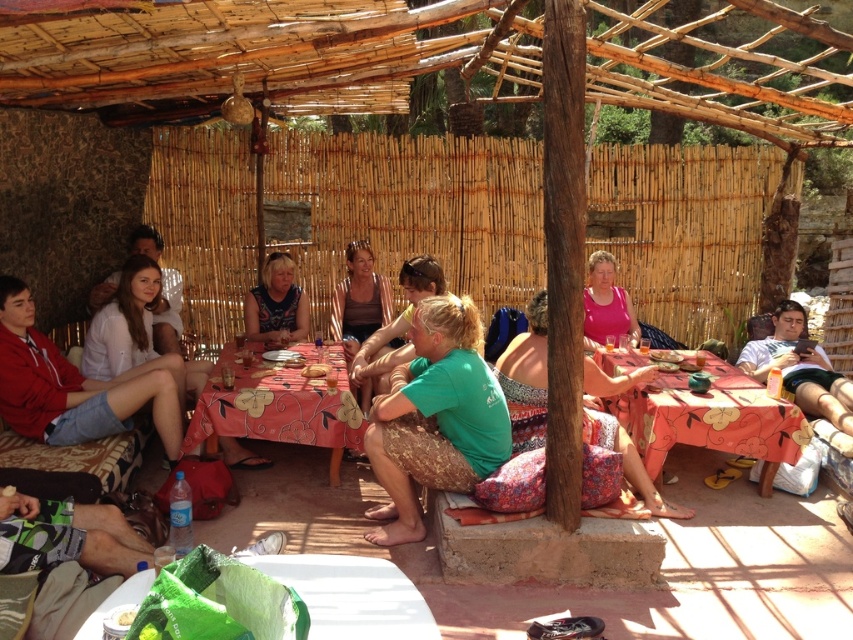
Question: Which object is closer to the camera taking this photo?

Choices:
 (A) light brown fabric skirt at lower left
 (B) floral fabric table at center
 (C) green fabric at center

Answer: (A)

Question: Can you confirm if floral-patterned fabric table at center is thinner than yellow matte bread at center?

Choices:
 (A) yes
 (B) no

Answer: (B)

Question: Does green paper bag at lower left have a greater width compared to pink matte shirt at center?

Choices:
 (A) yes
 (B) no

Answer: (A)

Question: Does floral-patterned fabric table at center appear on the left side of matte brown tank top at center?

Choices:
 (A) no
 (B) yes

Answer: (B)

Question: Which point is farther from the camera taking this photo?

Choices:
 (A) (267, 330)
 (B) (793, 432)
 (C) (392, 321)

Answer: (C)

Question: Among these points, which one is nearest to the camera?

Choices:
 (A) (395, 620)
 (B) (352, 368)
 (C) (279, 252)

Answer: (A)